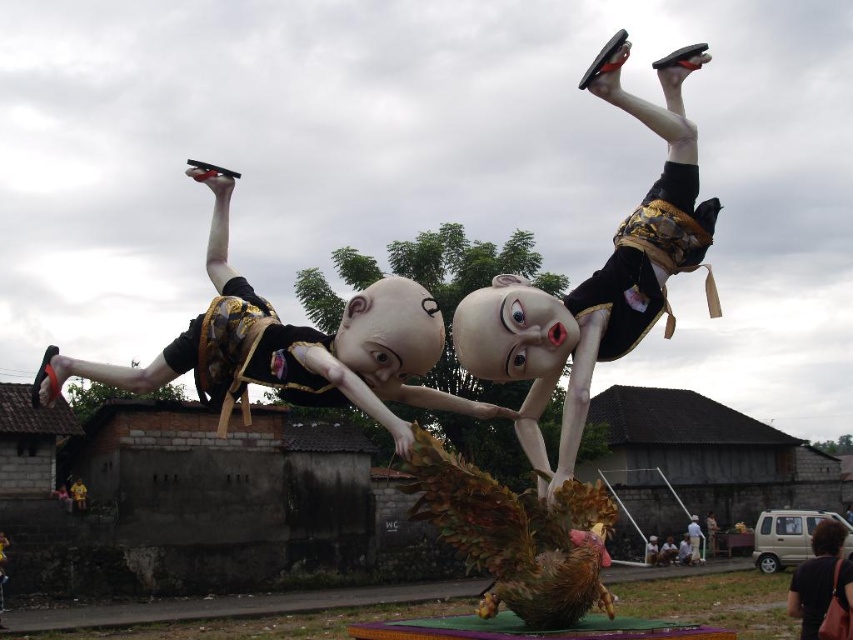
Question: Can you confirm if white matte person at center is positioned to the right of matte black figure at center?

Choices:
 (A) yes
 (B) no

Answer: (A)

Question: Is matte black figure at upper center positioned in front of white matte person at center?

Choices:
 (A) yes
 (B) no

Answer: (A)

Question: Which point is closer to the camera?

Choices:
 (A) (840, 621)
 (B) (695, 524)
 (C) (564, 474)

Answer: (C)

Question: Which point is closer to the camera taking this photo?

Choices:
 (A) (659, 218)
 (B) (676, 550)
 (C) (703, 554)

Answer: (A)

Question: Does matte black figure at upper center appear under matte black figure at center?

Choices:
 (A) no
 (B) yes

Answer: (A)

Question: Which of the following is the farthest from the observer?

Choices:
 (A) matte black figure at upper center
 (B) matte black figure at left
 (C) matte black figure at center

Answer: (C)